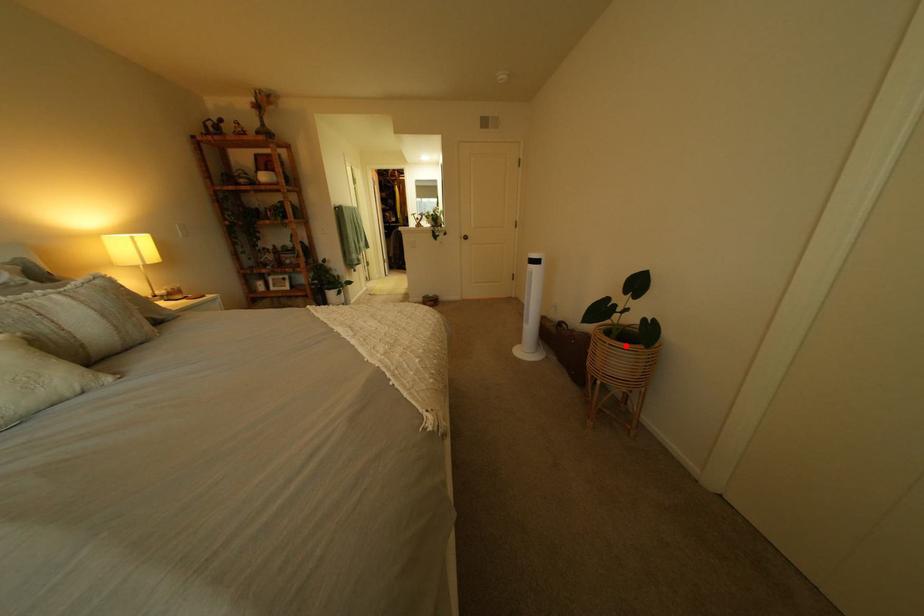
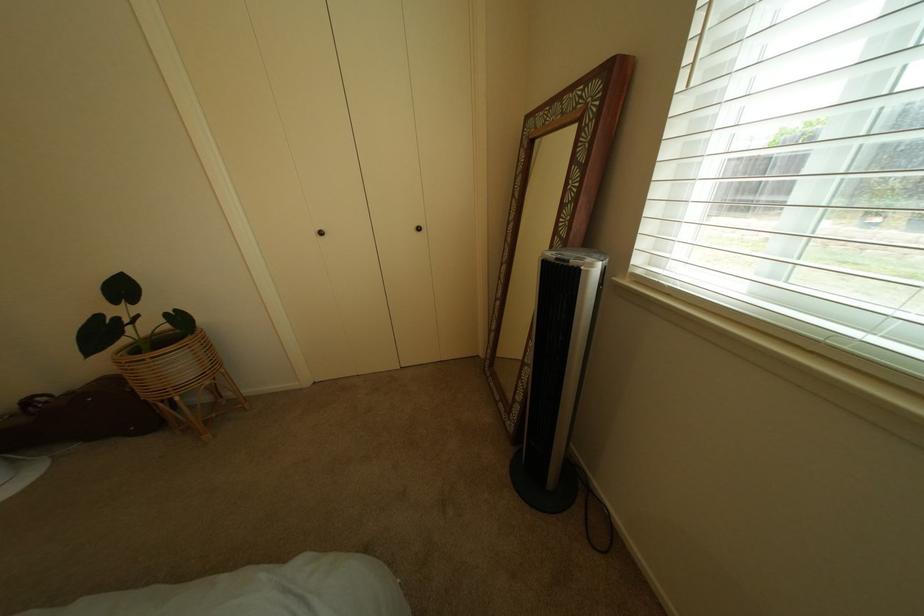
Where in the second image is the point corresponding to the highlighted location from the first image?

(167, 359)